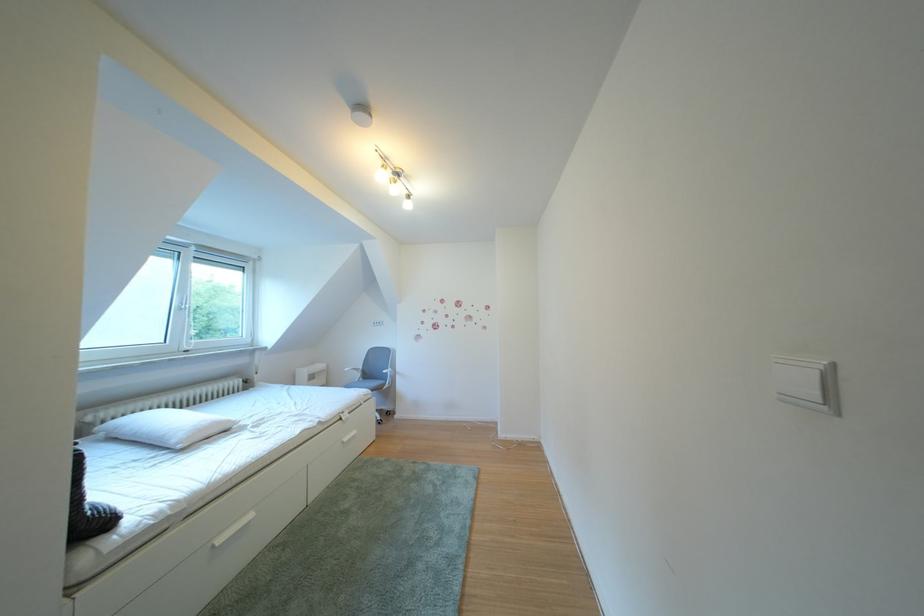
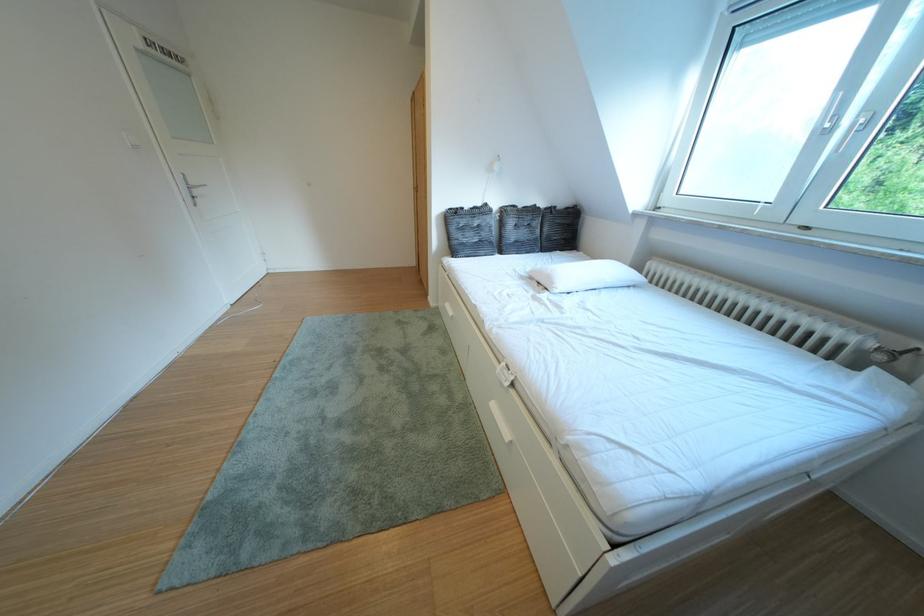
Locate, in the second image, the point that corresponds to pixel 242 427 in the first image.

(565, 288)